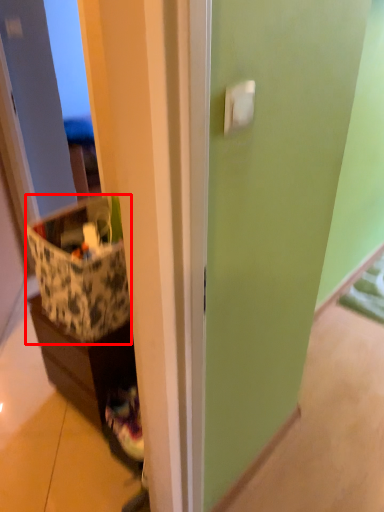
Question: Considering the relative positions of storage box (annotated by the red box) and cabinetry in the image provided, where is storage box (annotated by the red box) located with respect to the staircase?

Choices:
 (A) right
 (B) left

Answer: (A)